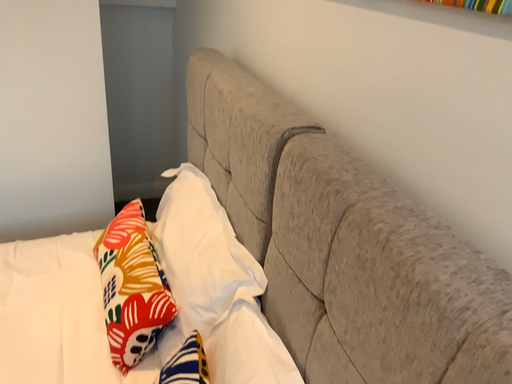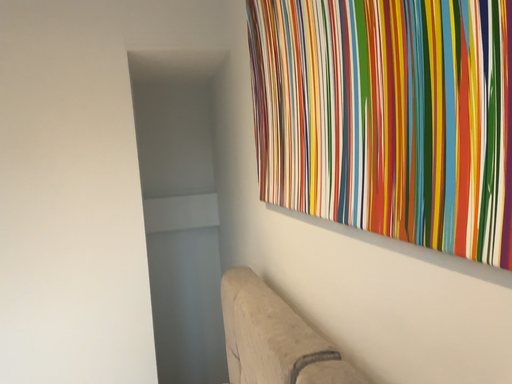
Question: How did the camera likely rotate when shooting the video?

Choices:
 (A) rotated upward
 (B) rotated downward

Answer: (A)